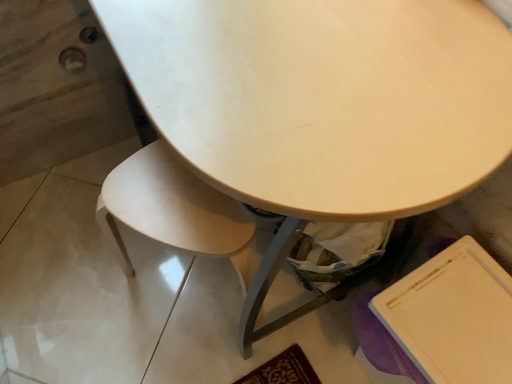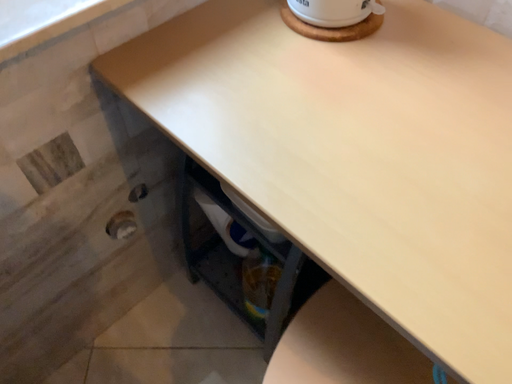
Question: How did the camera likely rotate when shooting the video?

Choices:
 (A) rotated right
 (B) rotated left

Answer: (A)